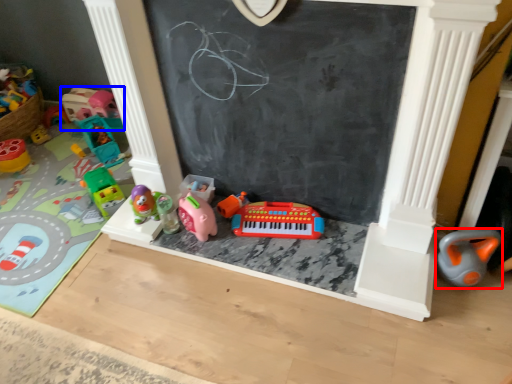
Question: Which point is closer to the camera, toy (highlighted by a red box) or toy (highlighted by a blue box)?

Choices:
 (A) toy
 (B) toy

Answer: (A)